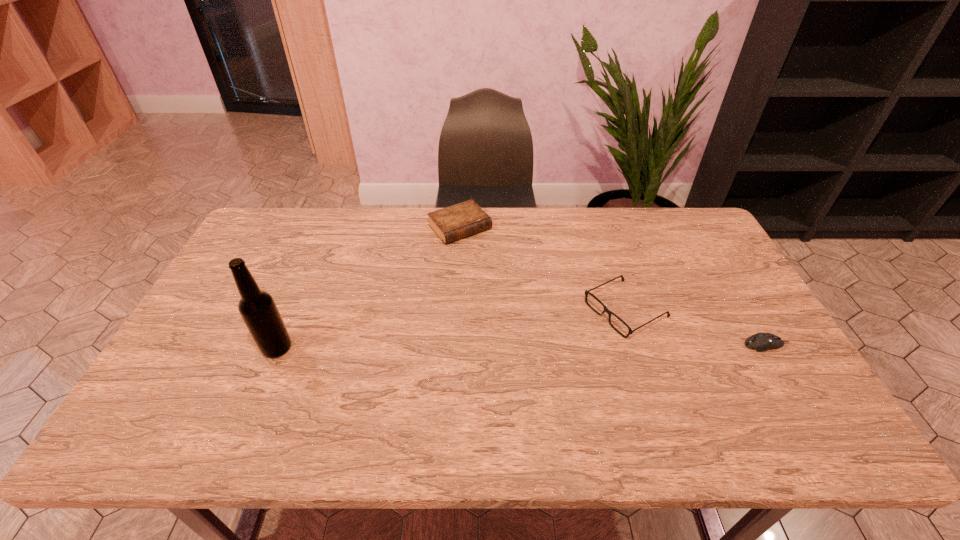
The width and height of the screenshot is (960, 540). I want to click on the leftmost object, so click(x=257, y=308).

This screenshot has height=540, width=960. In order to click on the tallest object in this screenshot , I will do `click(257, 308)`.

Image resolution: width=960 pixels, height=540 pixels. Find the location of `the rightmost object`. the rightmost object is located at coordinates tap(761, 342).

In order to click on computer mouse in this screenshot , I will do `click(761, 342)`.

At what (x,y) coordinates should I click in order to perform the action: click on spectacles. Please return your answer as a coordinate pair (x, y). The height and width of the screenshot is (540, 960). Looking at the image, I should click on [606, 310].

Identify the location of the third object from right to left. (458, 221).

The width and height of the screenshot is (960, 540). I want to click on diary, so click(x=458, y=221).

You are a GUI agent. You are given a task and a screenshot of the screen. Output one action in this format:
    pyautogui.click(x=<x>, y=<y>)
    Task: Click on the vacant space located on the right of the tallest object
    This screenshot has height=540, width=960.
    Given the screenshot: What is the action you would take?
    pyautogui.click(x=421, y=348)

The height and width of the screenshot is (540, 960). I want to click on vacant area located on the back of the computer mouse, so click(727, 279).

Find the location of a particular element. The width and height of the screenshot is (960, 540). vacant space located 0.360m on the front-facing side of the spectacles is located at coordinates (486, 387).